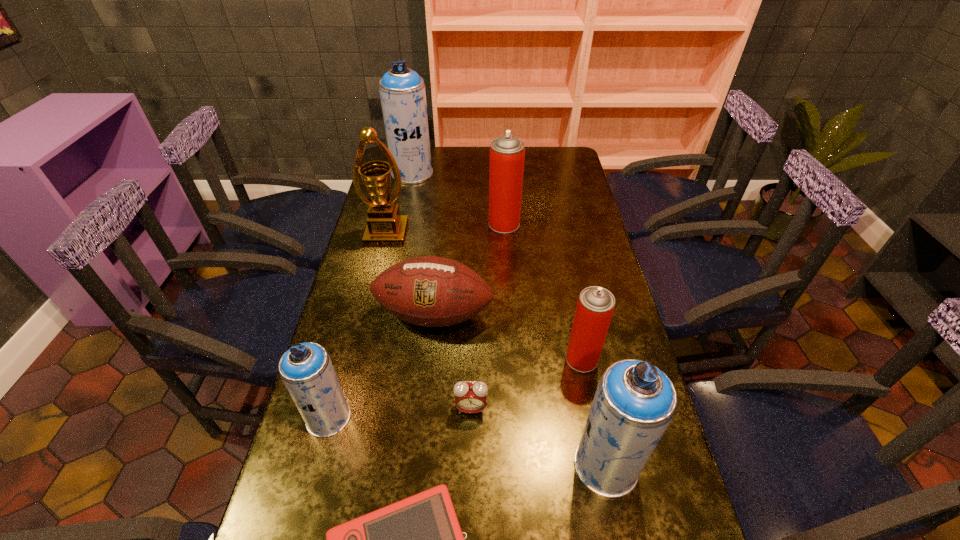
Where is `the farthest object`? This screenshot has width=960, height=540. the farthest object is located at coordinates (402, 92).

Locate an element on the screen. Image resolution: width=960 pixels, height=540 pixels. the farthest aerosol can is located at coordinates (402, 92).

The width and height of the screenshot is (960, 540). Identify the location of award. (385, 227).

At what (x,y) coordinates should I click in order to perform the action: click on the third aerosol can from left to right. Please return your answer as a coordinate pair (x, y). The width and height of the screenshot is (960, 540). Looking at the image, I should click on (507, 153).

Identify the location of the left red aerosol can. Image resolution: width=960 pixels, height=540 pixels. (507, 153).

In order to click on the second biggest blue aerosol can in this screenshot , I will do `click(634, 403)`.

This screenshot has height=540, width=960. What are the coordinates of `the smallest blue aerosol can` in the screenshot? It's located at point(306,369).

Identify the location of the fifth farthest object. (595, 306).

The width and height of the screenshot is (960, 540). Find the location of `the nearer red aerosol can`. the nearer red aerosol can is located at coordinates (595, 306).

Image resolution: width=960 pixels, height=540 pixels. I want to click on football (American), so click(x=430, y=291).